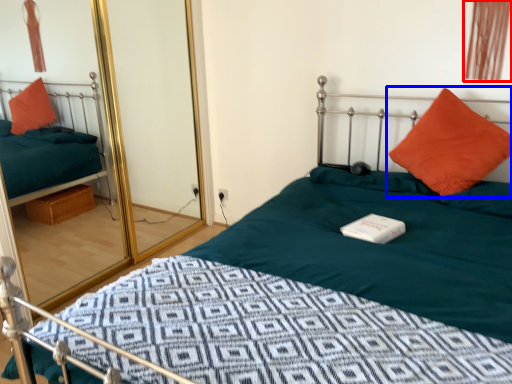
Question: Which object appears closest to the camera in this image, curtain (highlighted by a red box) or pillow (highlighted by a blue box)?

Choices:
 (A) curtain
 (B) pillow

Answer: (B)